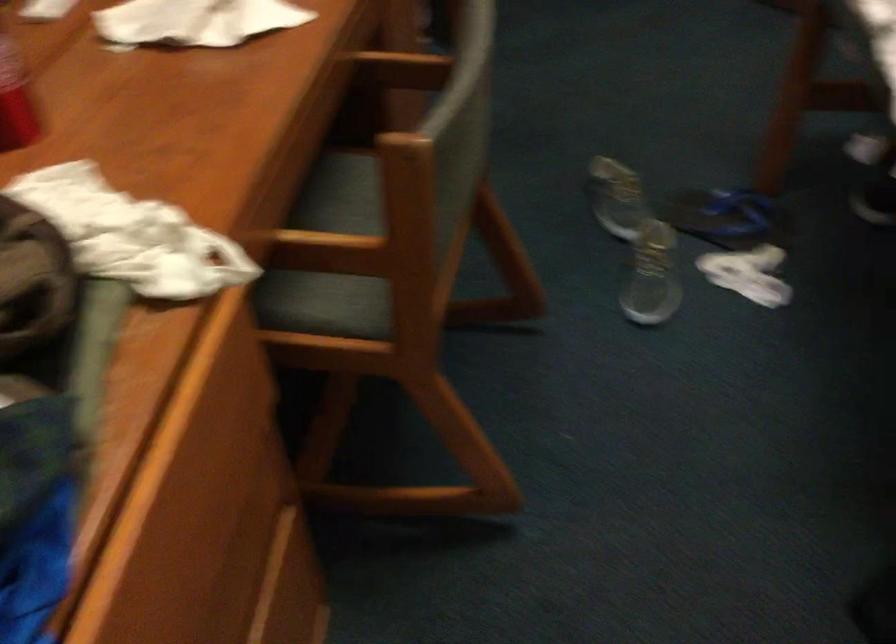
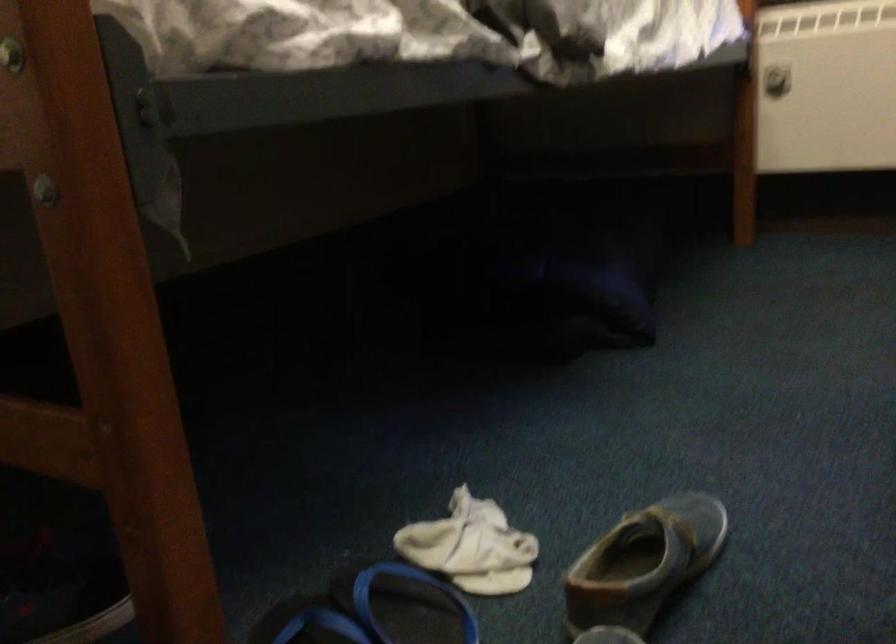
Locate, in the second image, the point that corresponds to point 653,290 in the first image.

(643, 563)